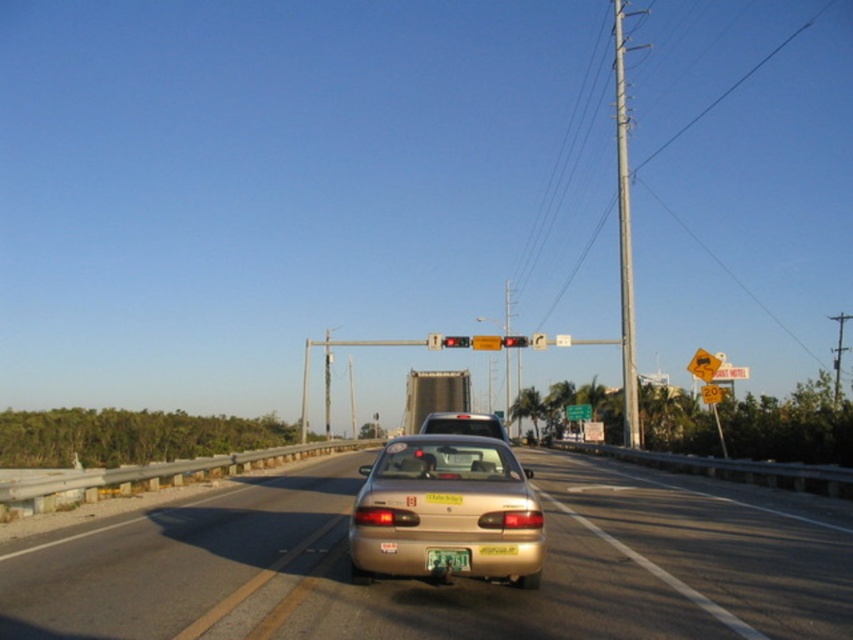
Question: Among these points, which one is farthest from the camera?

Choices:
 (A) click(x=567, y=417)
 (B) click(x=466, y=346)

Answer: (A)

Question: Is gold metallic sedan at center wider than red glass traffic light at center?

Choices:
 (A) yes
 (B) no

Answer: (B)

Question: Considering the real-world distances, which object is farthest from the gold metallic sedan at center?

Choices:
 (A) gold matte sedan at center
 (B) green reflective sign at center
 (C) red glass traffic light at center

Answer: (B)

Question: Considering the real-world distances, which object is closest to the green reflective sign at center?

Choices:
 (A) silver metallic pole at right
 (B) green matte license plate at center

Answer: (A)

Question: Can you confirm if green matte license plate at center is smaller than green reflective sign at center?

Choices:
 (A) yes
 (B) no

Answer: (A)

Question: Can you confirm if gold metallic sedan at center is smaller than yellow plastic sign at center?

Choices:
 (A) yes
 (B) no

Answer: (A)